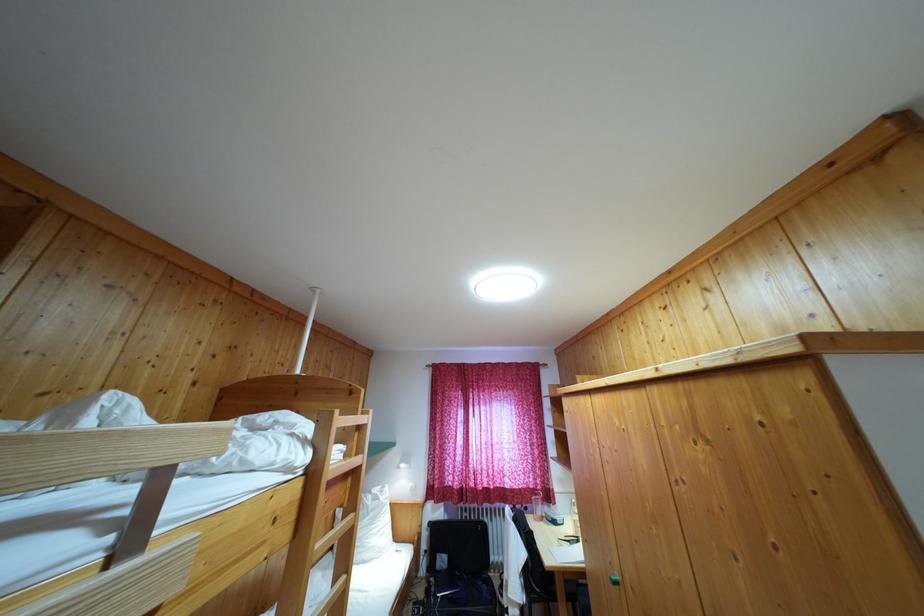
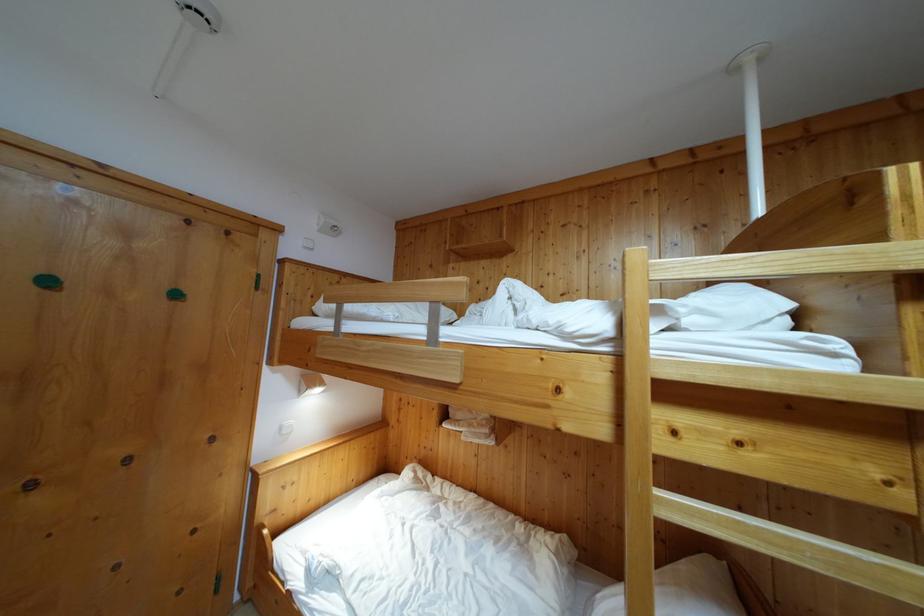
The point at (355, 463) is marked in the first image. Where is the corresponding point in the second image?

(908, 382)